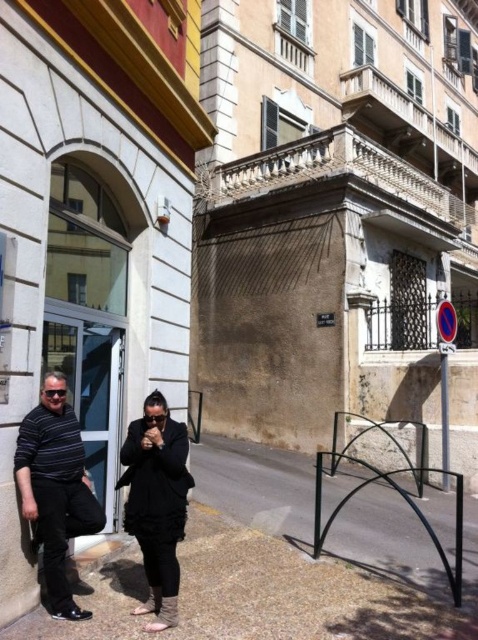
Does black metal bike rack at lower center appear on the right side of black matte clothing at center?

Correct, you'll find black metal bike rack at lower center to the right of black matte clothing at center.

The height and width of the screenshot is (640, 478). In order to click on black metal bike rack at lower center in this screenshot , I will do `click(409, 534)`.

Does striped cotton shirt at left appear on the right side of black matte coat at center?

In fact, striped cotton shirt at left is to the left of black matte coat at center.

Is striped cotton shirt at left bigger than black matte coat at center?

No, striped cotton shirt at left is not bigger than black matte coat at center.

Find the location of a particular element. striped cotton shirt at left is located at coordinates (55, 488).

Does point (36, 429) come closer to viewer compared to point (163, 513)?

No, it is not.

Which is more to the left, black matte clothing at center or black matte coat at center?

From the viewer's perspective, black matte clothing at center appears more on the left side.

Between point (52, 560) and point (149, 506), which one is positioned in front?

Point (52, 560)

Where is `black matte clothing at center`? black matte clothing at center is located at coordinates (55, 488).